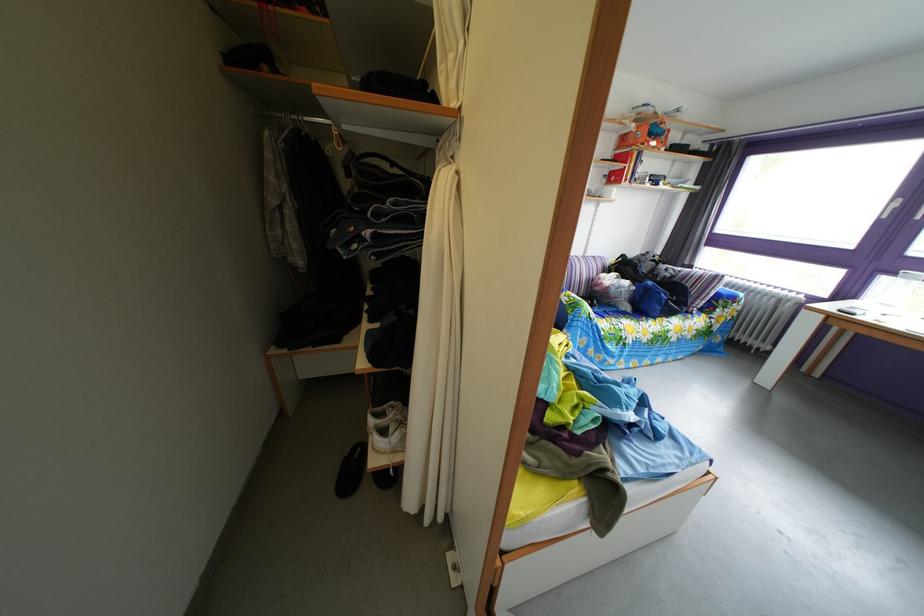
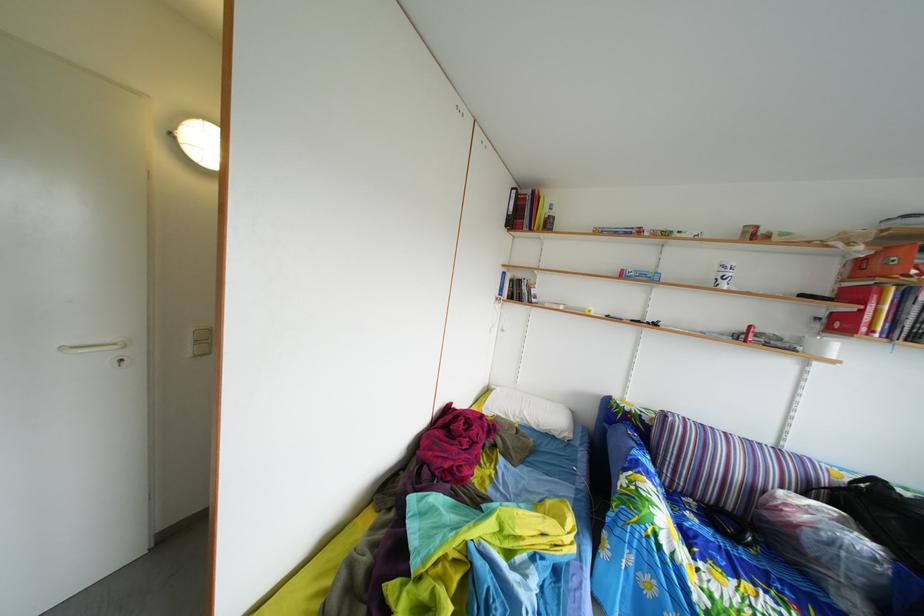
Question: I am providing you with two images of the same scene from different viewpoints. After the viewpoint changes to image2, which objects are now occluded?

Choices:
 (A) white curtain
 (B) orange box
 (C) printer touchscreen
 (D) plastic water bottle

Answer: (A)